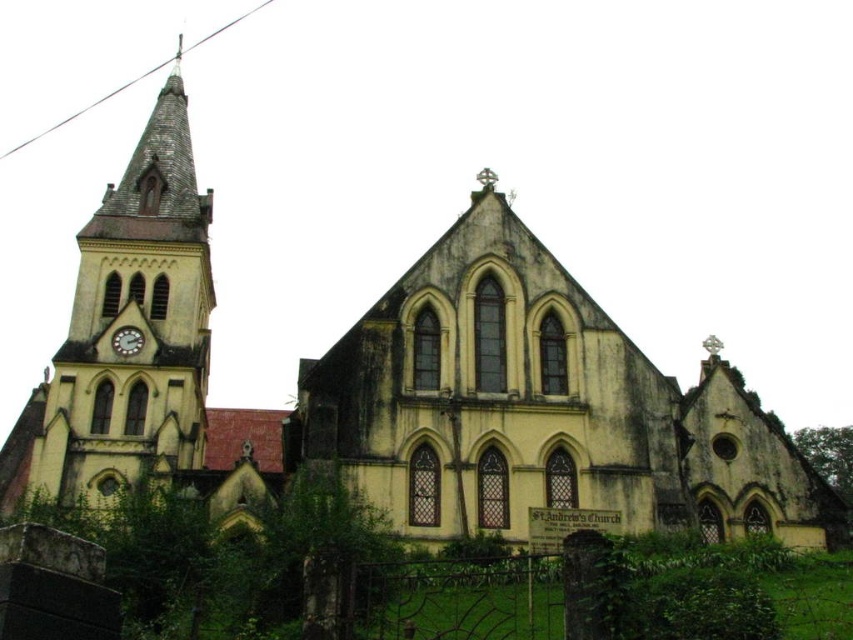
Between point (148, 163) and point (117, 340), which one is positioned behind?

Point (148, 163)

Image resolution: width=853 pixels, height=640 pixels. I want to click on yellow stone clock tower at left, so click(x=123, y=324).